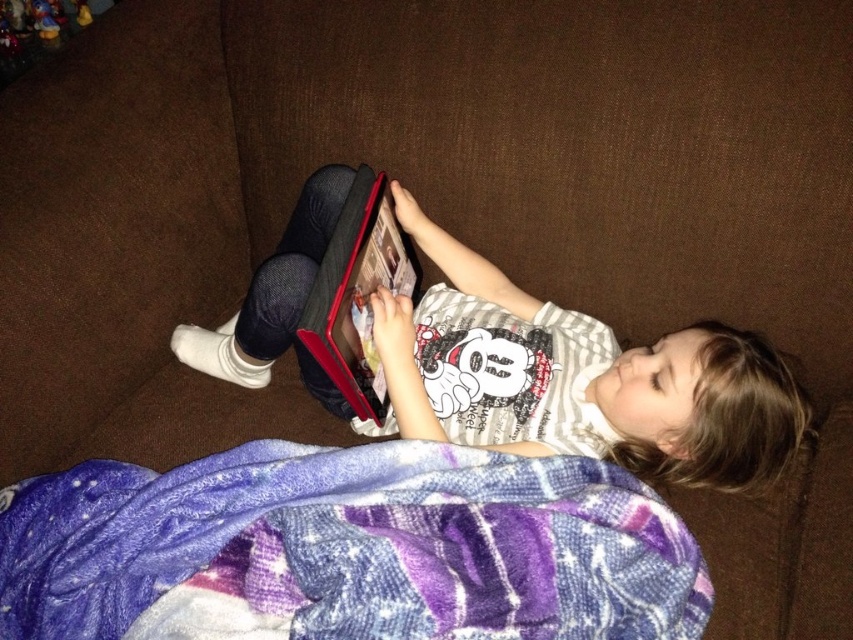
Where is `purple fleece blanket at lower center`? purple fleece blanket at lower center is located at coordinates (347, 548).

Is purple fleece blanket at lower center above plush yellow duck at upper left?

No, purple fleece blanket at lower center is not above plush yellow duck at upper left.

Does point (328, 541) come in front of point (48, 20)?

Yes, it is in front of point (48, 20).

Image resolution: width=853 pixels, height=640 pixels. In order to click on purple fleece blanket at lower center in this screenshot , I will do `click(347, 548)`.

Who is positioned more to the right, purple fleece blanket at lower center or matte black tablet at center?

Positioned to the right is matte black tablet at center.

Consider the image. Does purple fleece blanket at lower center have a larger size compared to matte black tablet at center?

No.

Does point (125, 515) come behind point (508, 408)?

No, it is in front of (508, 408).

This screenshot has height=640, width=853. In order to click on purple fleece blanket at lower center in this screenshot , I will do `click(347, 548)`.

Is matte black tablet at center positioned in front of plush yellow duck at upper left?

Yes.

Does matte black tablet at center have a larger size compared to plush yellow duck at upper left?

Yes, matte black tablet at center is bigger than plush yellow duck at upper left.

What are the coordinates of `matte black tablet at center` in the screenshot? It's located at (518, 364).

Find the location of a particular element. This screenshot has height=640, width=853. matte black tablet at center is located at coordinates (518, 364).